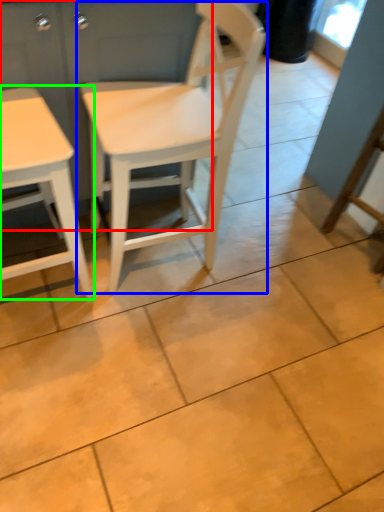
Question: Which object is positioned farthest from dresser (highlighted by a red box)? Select from chair (highlighted by a blue box) and table (highlighted by a green box).

Choices:
 (A) chair
 (B) table

Answer: (B)